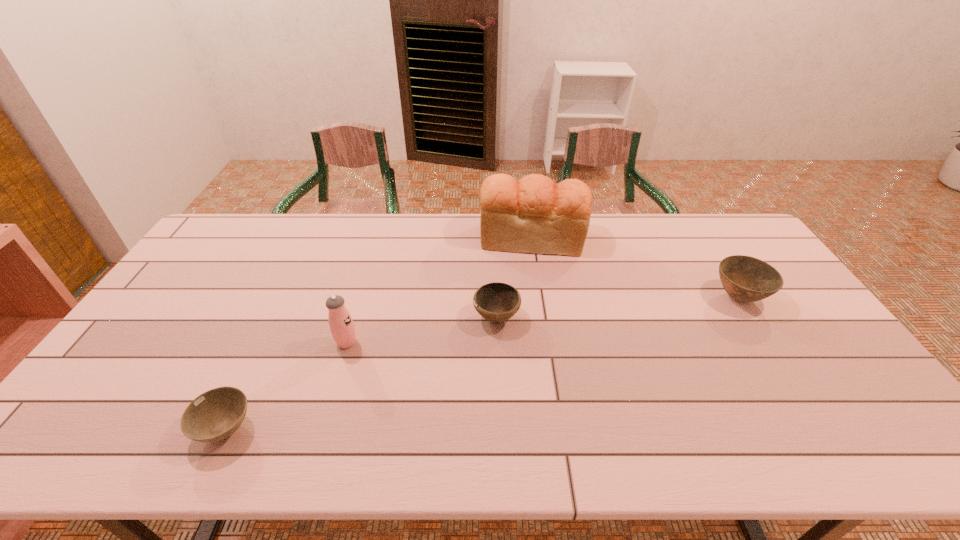
In the image, there is a desktop. Where is `vacant area at the right edge`? vacant area at the right edge is located at coordinates (749, 306).

You are a GUI agent. You are given a task and a screenshot of the screen. Output one action in this format:
    pyautogui.click(x=<x>, y=<y>)
    Task: Click on the vacant space at the far left corner
    This screenshot has height=540, width=960.
    Given the screenshot: What is the action you would take?
    248,237

This screenshot has height=540, width=960. Find the location of `free location at the far right corner`. free location at the far right corner is located at coordinates (698, 219).

In order to click on vacant region between the nearest object and the tallest bowl in this screenshot , I will do `click(482, 363)`.

Where is `free space between the bread and the second tallest object`? The height and width of the screenshot is (540, 960). free space between the bread and the second tallest object is located at coordinates (440, 291).

The width and height of the screenshot is (960, 540). Find the location of `free point between the farthest object and the thermos bottle`. free point between the farthest object and the thermos bottle is located at coordinates (440, 291).

Image resolution: width=960 pixels, height=540 pixels. I want to click on free point between the rightmost object and the leftmost bowl, so click(x=482, y=363).

Identify the location of free spot between the second object from left to right and the tallest bowl. The image size is (960, 540). (542, 320).

Where is `blank region between the second bowl from left to right and the tallest bowl`? blank region between the second bowl from left to right and the tallest bowl is located at coordinates (617, 308).

Where is `unoccupied position between the rightmost object and the tallest object`? The image size is (960, 540). unoccupied position between the rightmost object and the tallest object is located at coordinates (636, 268).